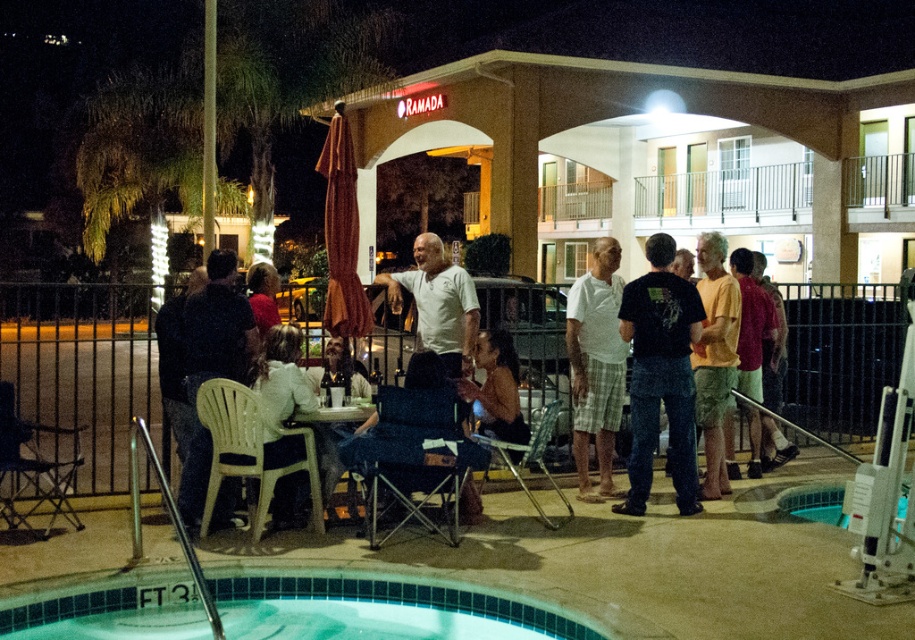
You are standing at the point labeled as point (x=379, y=608) in the image. What is the nearest object to you in the scene?

The nearest object to you is the blue tile swimming pool at lower left because the point (x=379, y=608) is located on it.

You are standing at the pool edge and want to walk to the point labeled as point [583,426]. There is an obstacle at point [171,588]. Will you have to go around the obstacle to reach your destination?

Point [171,588] is in front of point [583,426], so you will have to go around the obstacle at point [171,588] to reach point [583,426].

You are standing at the edge of the pool and want to sit down. You see a matte white chair at center and white plaid shorts at center. Which one is on the right side from your perspective?

The matte white chair at center is to the right of white plaid shorts at center, so the matte white chair at center is on the right side.